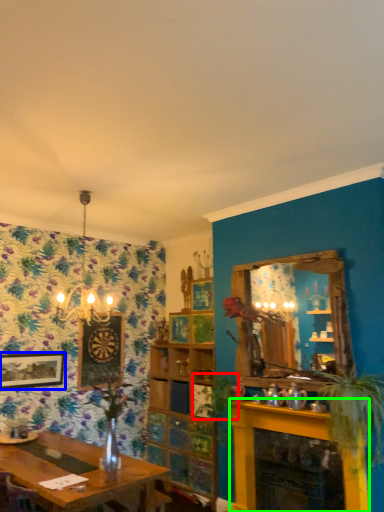
Question: Based on their relative distances, which object is nearer to plant (highlighted by a red box)? Choose from picture frame (highlighted by a blue box) and fireplace (highlighted by a green box).

Choices:
 (A) picture frame
 (B) fireplace

Answer: (B)